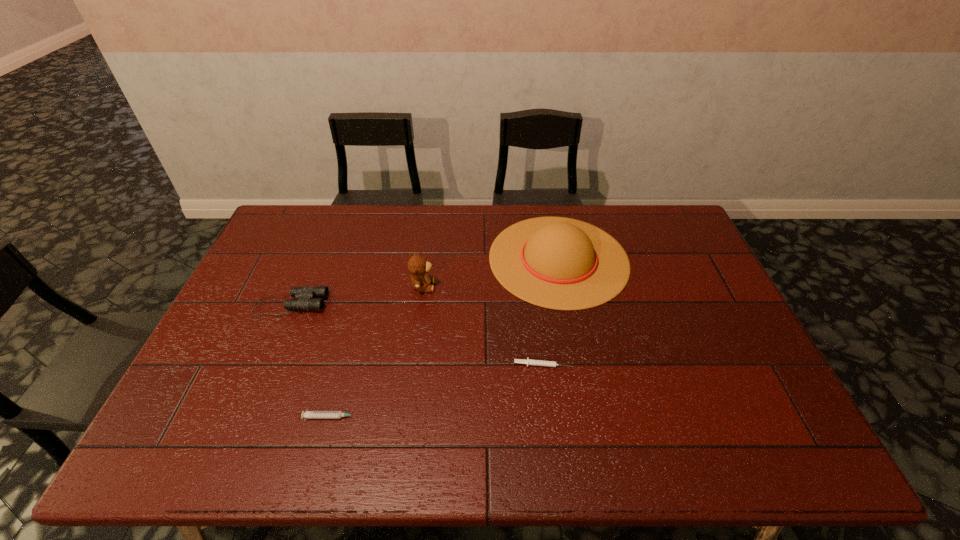
Find the location of a particular element. The width and height of the screenshot is (960, 540). blank space at the near right corner of the desktop is located at coordinates [x=747, y=434].

Find the location of a particular element. The image size is (960, 540). free spot between the leftmost object and the shorter syringe is located at coordinates (417, 334).

Locate an element on the screen. The height and width of the screenshot is (540, 960). empty space between the sombrero and the fourth tallest object is located at coordinates (445, 338).

Where is `free point between the taller syringe and the third shortest object`? free point between the taller syringe and the third shortest object is located at coordinates (312, 361).

Where is `free spot between the sombrero and the second shortest object`? free spot between the sombrero and the second shortest object is located at coordinates (445, 338).

Locate an element on the screen. free space between the sombrero and the farther syringe is located at coordinates (550, 312).

Find the location of a particular element. vacant area that lies between the sombrero and the teddy bear is located at coordinates (491, 272).

The image size is (960, 540). Identify the location of empty space between the leftmost object and the left syringe. (312, 361).

Identify the location of vacant area between the third object from left to right and the binoculars. This screenshot has height=540, width=960. (356, 295).

Identify the location of free space between the taller syringe and the leftmost object. (312, 361).